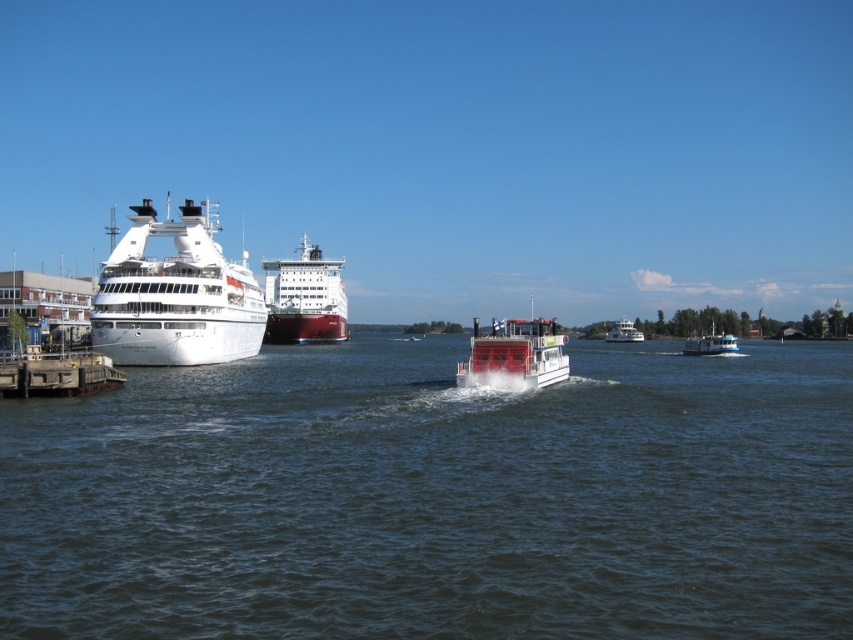
Question: Which point appears farthest from the camera in this image?

Choices:
 (A) (102, 385)
 (B) (625, 461)
 (C) (465, 362)
 (D) (607, 333)

Answer: (D)

Question: Which point is closer to the camera?

Choices:
 (A) (688, 349)
 (B) (183, 298)
 (C) (621, 340)

Answer: (B)

Question: Is blue glossy ferry at right above white glossy boat at upper center?

Choices:
 (A) yes
 (B) no

Answer: (B)

Question: Can you confirm if dark blue water at center is positioned to the right of red matte cargo ship at center?

Choices:
 (A) no
 (B) yes

Answer: (B)

Question: Is white glossy ferry at center further to the viewer compared to concrete dock at lower left?

Choices:
 (A) no
 (B) yes

Answer: (B)

Question: Which of the following is the farthest from the observer?

Choices:
 (A) white glossy cruise ship at left
 (B) concrete dock at lower left
 (C) white glossy boat at upper center
 (D) dark blue water at center

Answer: (C)